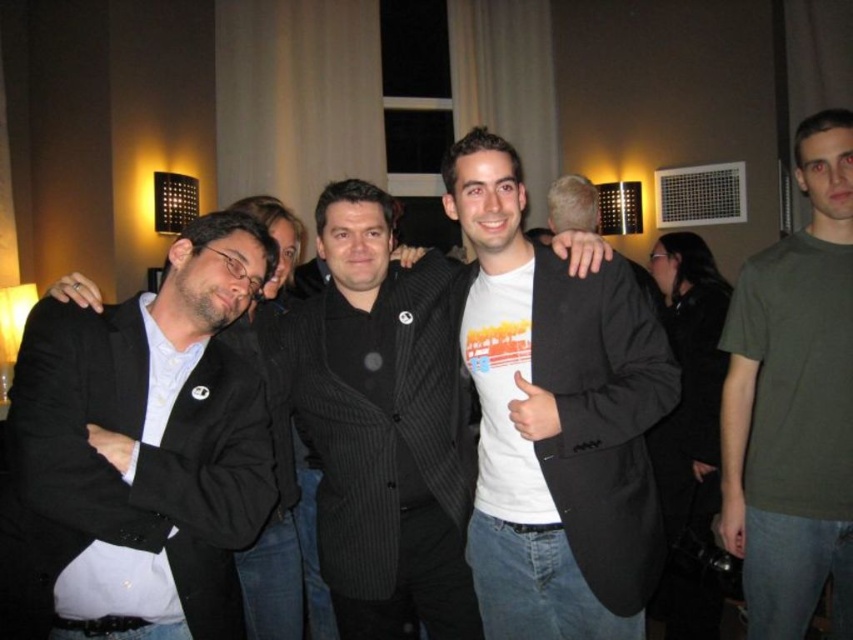
Question: Where is black pinstripe suit at center located in relation to green matte t-shirt at right in the image?

Choices:
 (A) left
 (B) right

Answer: (A)

Question: Is white matte t-shirt at center in front of black pinstripe suit at center?

Choices:
 (A) yes
 (B) no

Answer: (A)

Question: Which point is closer to the camera taking this photo?

Choices:
 (A) (172, 412)
 (B) (524, 420)

Answer: (A)

Question: Which object is positioned farthest from the black pinstripe suit at center?

Choices:
 (A) white matte t-shirt at center
 (B) green matte t-shirt at right
 (C) matte black blazer at left

Answer: (B)

Question: Does matte black blazer at left appear over white matte t-shirt at center?

Choices:
 (A) yes
 (B) no

Answer: (B)

Question: Which object is the farthest from the green matte t-shirt at right?

Choices:
 (A) matte black blazer at left
 (B) white matte t-shirt at center
 (C) black pinstripe suit at center

Answer: (A)